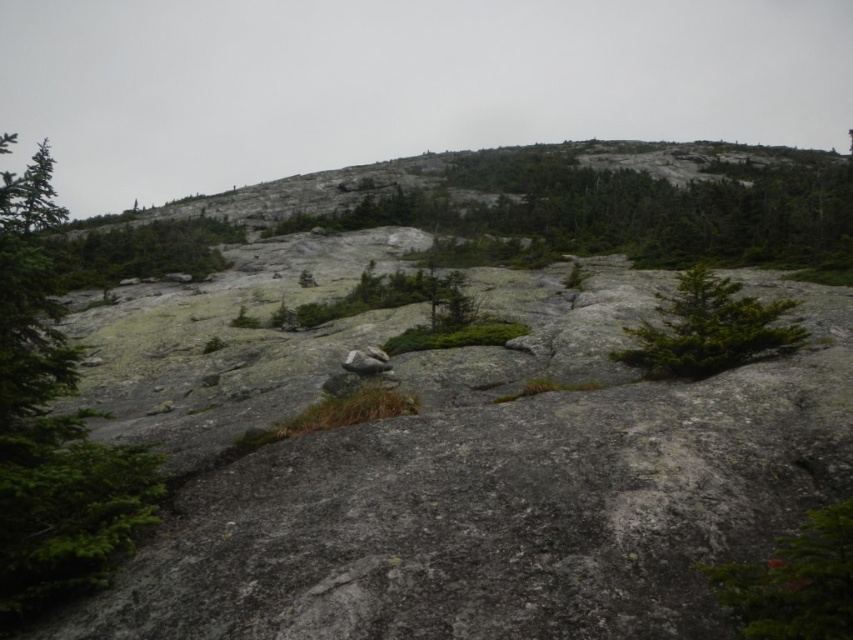
Question: Which point appears farthest from the camera in this image?

Choices:
 (A) (1, 195)
 (B) (846, 588)
 (C) (728, 355)

Answer: (C)

Question: Which object appears closest to the camera in this image?

Choices:
 (A) green matte tree at lower right
 (B) green matte tree at center-right
 (C) green matte tree at left

Answer: (A)

Question: Is green matte tree at center-right thinner than green textured shrub at upper left?

Choices:
 (A) yes
 (B) no

Answer: (A)

Question: Which point is closer to the camera?

Choices:
 (A) green matte tree at center-right
 (B) green matte tree at left
 (C) green textured shrub at upper left

Answer: (B)

Question: Is green matte tree at lower right positioned in front of green textured shrub at upper left?

Choices:
 (A) no
 (B) yes

Answer: (B)

Question: Does green matte tree at left have a larger size compared to green textured shrub at upper left?

Choices:
 (A) yes
 (B) no

Answer: (B)